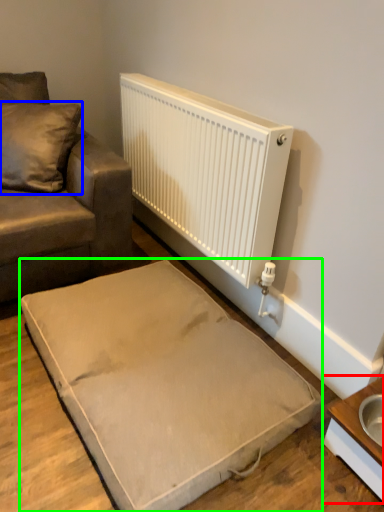
Question: Considering the real-world distances, which object is farthest from table (highlighted by a red box)? pillow (highlighted by a blue box) or furniture (highlighted by a green box)?

Choices:
 (A) pillow
 (B) furniture

Answer: (A)